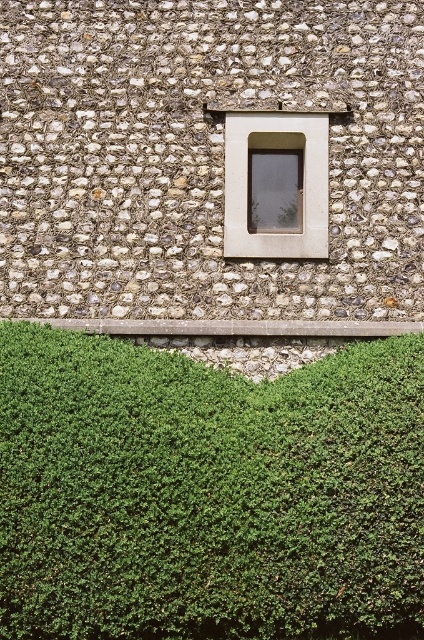
Which is more to the left, green leafy hedge at bottom or matte glass window at center?

green leafy hedge at bottom is more to the left.

Does green leafy hedge at bottom have a larger size compared to matte glass window at center?

Indeed, green leafy hedge at bottom has a larger size compared to matte glass window at center.

The image size is (424, 640). I want to click on green leafy hedge at bottom, so click(208, 493).